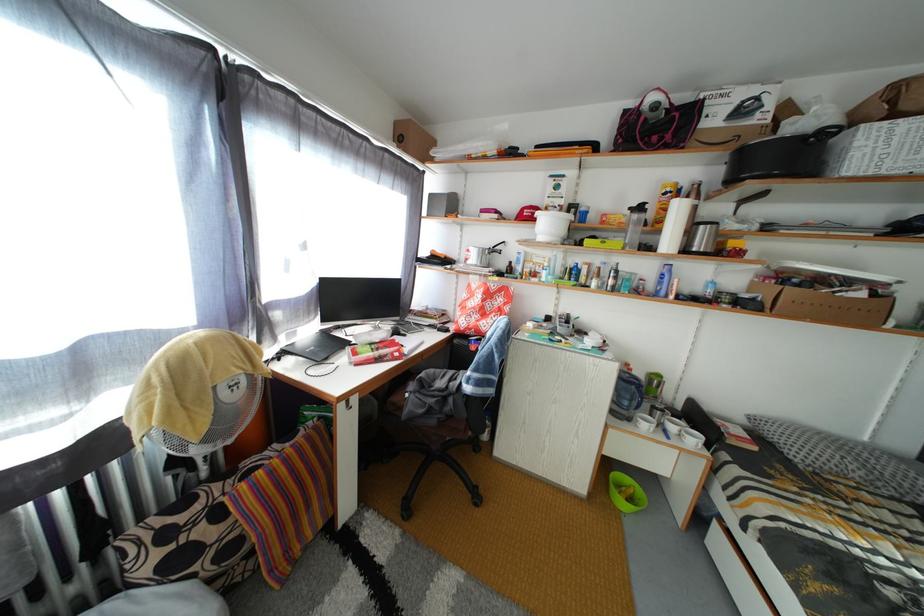
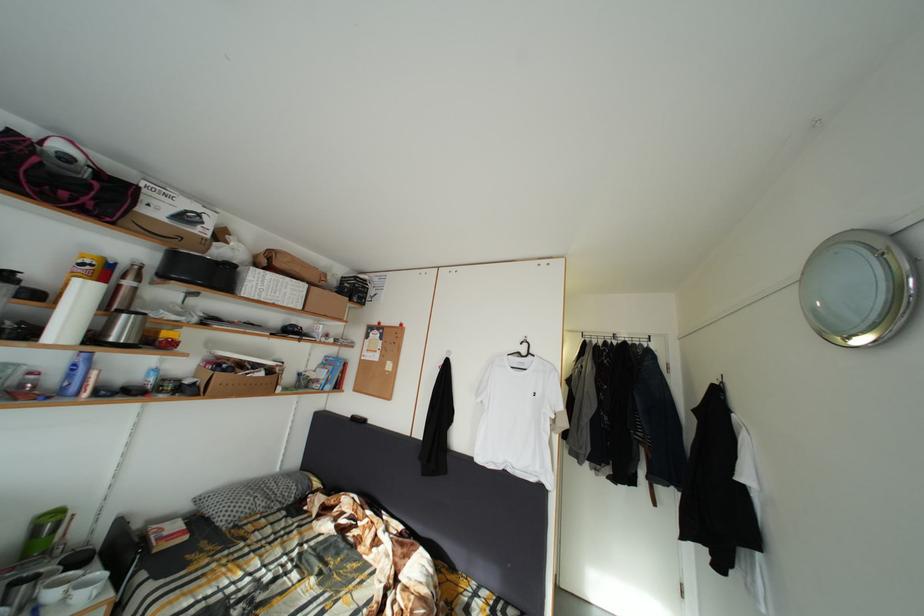
The point at (858,289) is marked in the first image. Where is the corresponding point in the second image?

(264, 373)